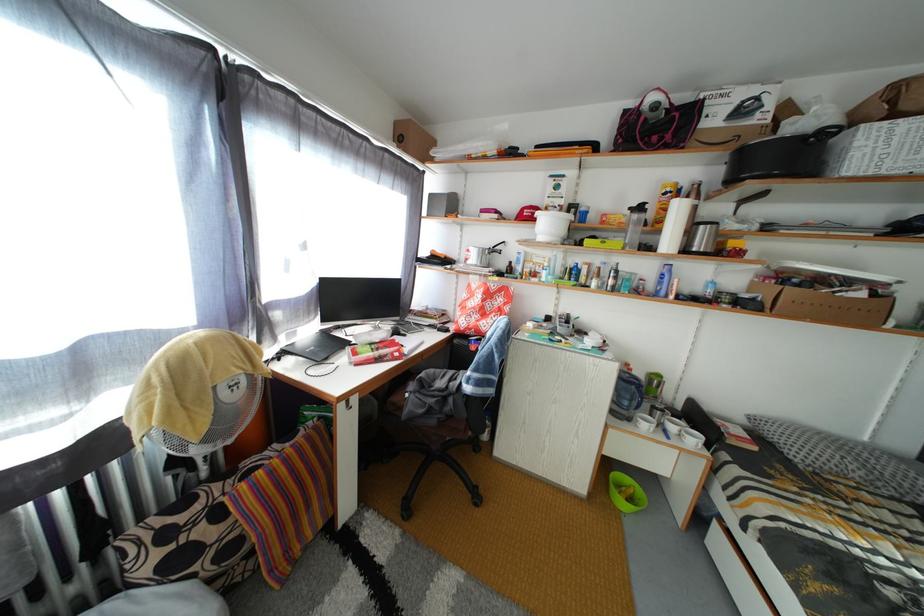
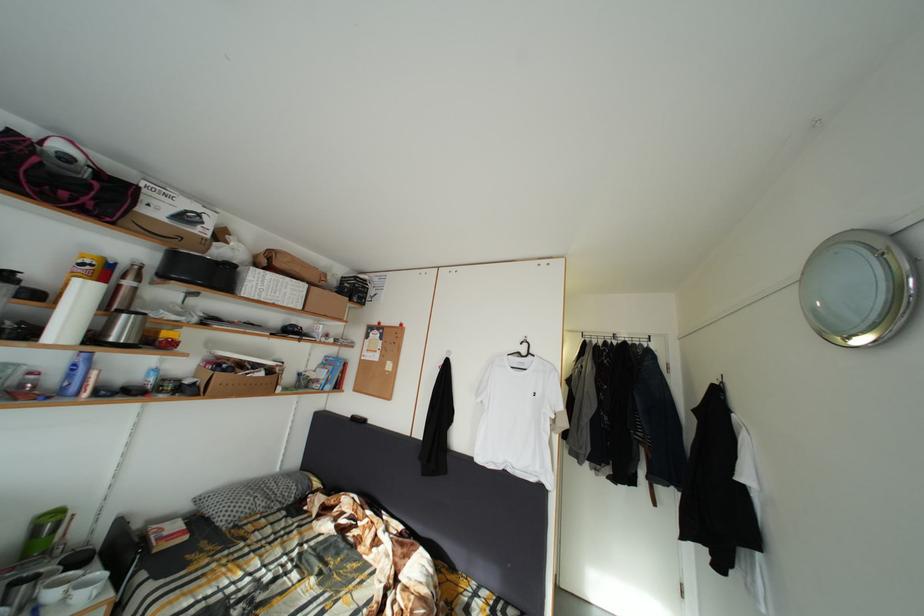
The point at (858,289) is marked in the first image. Where is the corresponding point in the second image?

(264, 373)